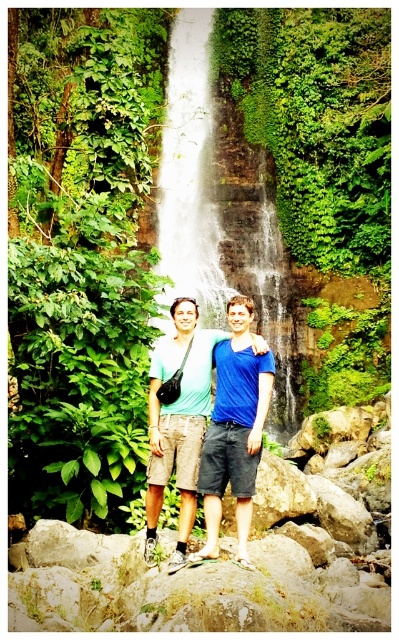
From the picture: Is white textured waterfall at center wider than blue matte shirt at center?

Correct, the width of white textured waterfall at center exceeds that of blue matte shirt at center.

Who is positioned more to the right, white textured waterfall at center or blue matte shirt at center?

blue matte shirt at center

Which is behind, point (272, 291) or point (244, 518)?

Positioned behind is point (272, 291).

Locate an element on the screen. white textured waterfall at center is located at coordinates (221, 209).